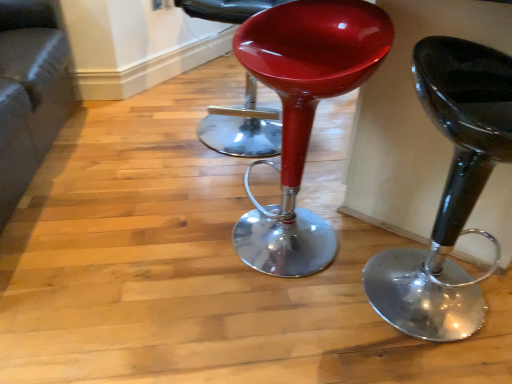
Question: Does glossy plastic stool at center, which is counted as the 1th stool, starting from the left, have a greater height compared to velvet grey couch at lower left?

Choices:
 (A) no
 (B) yes

Answer: (B)

Question: Considering the relative positions of glossy plastic stool at center, the 2th stool when ordered from right to left, and velvet grey couch at lower left in the image provided, is glossy plastic stool at center, the 2th stool when ordered from right to left, to the left of velvet grey couch at lower left from the viewer's perspective?

Choices:
 (A) no
 (B) yes

Answer: (A)

Question: Is glossy plastic stool at center, the 2th stool when ordered from right to left, smaller than velvet grey couch at lower left?

Choices:
 (A) no
 (B) yes

Answer: (B)

Question: From the image's perspective, is glossy plastic stool at center, the 2th stool when ordered from right to left, above velvet grey couch at lower left?

Choices:
 (A) yes
 (B) no

Answer: (B)

Question: Is glossy plastic stool at center, which is counted as the 1th stool, starting from the left, touching velvet grey couch at lower left?

Choices:
 (A) no
 (B) yes

Answer: (A)

Question: Is point click(x=24, y=109) positioned closer to the camera than point click(x=446, y=231)?

Choices:
 (A) closer
 (B) farther

Answer: (B)

Question: Do you think velvet grey couch at lower left is within glossy plastic stool at center, the 1th stool in the right-to-left sequence, or outside of it?

Choices:
 (A) outside
 (B) inside

Answer: (A)

Question: From a real-world perspective, relative to glossy plastic stool at center, the 1th stool in the right-to-left sequence, is velvet grey couch at lower left vertically above or below?

Choices:
 (A) above
 (B) below

Answer: (B)

Question: Is velvet grey couch at lower left to the left or to the right of glossy plastic stool at center, the 1th stool in the right-to-left sequence, in the image?

Choices:
 (A) left
 (B) right

Answer: (A)

Question: From the image's perspective, is glossy plastic stool at center, the 2th stool when ordered from right to left, located above or below velvet grey couch at lower left?

Choices:
 (A) above
 (B) below

Answer: (B)

Question: Does point 264,29 appear closer or farther from the camera than point 50,107?

Choices:
 (A) farther
 (B) closer

Answer: (B)

Question: Looking at the image, does glossy plastic stool at center, which is counted as the 1th stool, starting from the left, seem bigger or smaller compared to velvet grey couch at lower left?

Choices:
 (A) small
 (B) big

Answer: (A)

Question: From their relative heights in the image, would you say glossy plastic stool at center, which is counted as the 1th stool, starting from the left, is taller or shorter than velvet grey couch at lower left?

Choices:
 (A) short
 (B) tall

Answer: (B)

Question: From the image's perspective, is velvet grey couch at lower left located above or below glossy plastic stool at center?

Choices:
 (A) below
 (B) above

Answer: (A)

Question: Is velvet grey couch at lower left bigger or smaller than glossy plastic stool at center?

Choices:
 (A) small
 (B) big

Answer: (B)